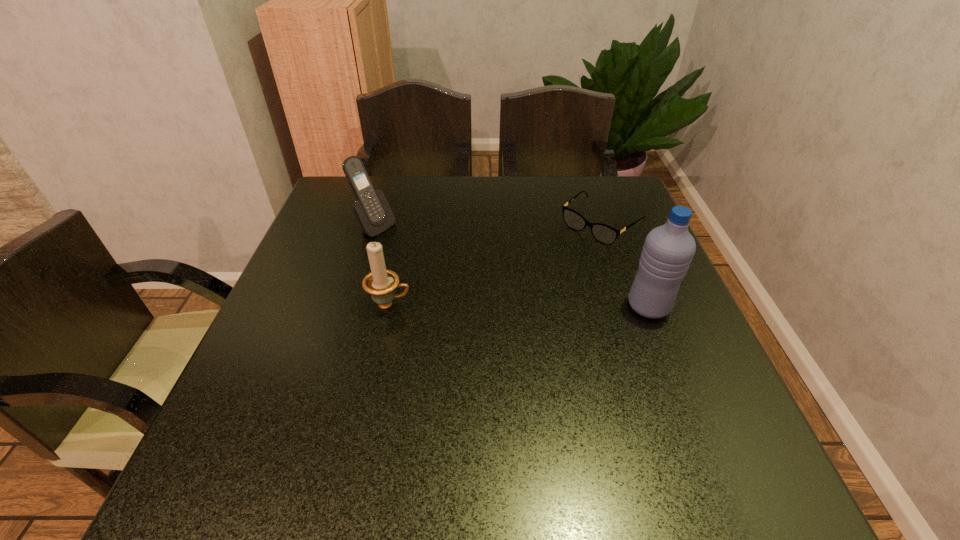
Identify the location of vacant space at the near edge. tap(320, 422).

Where is `free region at the left edge of the desktop`? This screenshot has width=960, height=540. free region at the left edge of the desktop is located at coordinates (334, 282).

I want to click on vacant region at the right edge of the desktop, so click(x=635, y=363).

This screenshot has height=540, width=960. Identify the location of vacant position at the far left corner of the desktop. (344, 199).

The image size is (960, 540). I want to click on free space at the near left corner, so click(x=303, y=404).

Identify the location of free space between the tallest object and the cellular telephone. This screenshot has width=960, height=540. click(512, 267).

The width and height of the screenshot is (960, 540). Identify the location of blank region between the water bottle and the candle_holder. (519, 306).

Find the location of a particular element. Image resolution: width=960 pixels, height=540 pixels. free space that is in between the water bottle and the cellular telephone is located at coordinates (512, 267).

Locate an element on the screen. Image resolution: width=960 pixels, height=540 pixels. free spot between the candle_holder and the tallest object is located at coordinates (519, 306).

Image resolution: width=960 pixels, height=540 pixels. Identify the location of free space between the candle_holder and the tallest object. (519, 306).